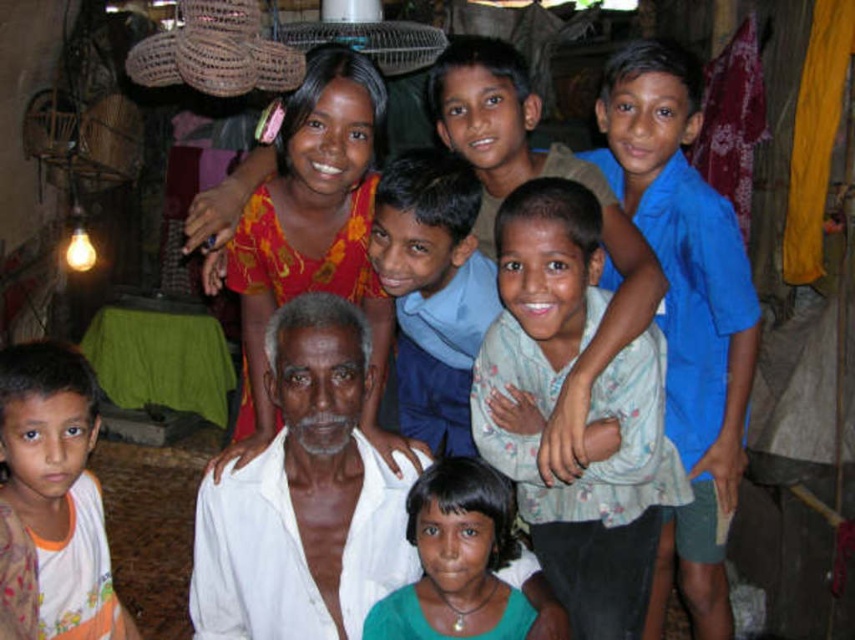
You are standing at the point marked by the coordinates point [638,262] in the image. What object is located exactly at that point?

The point [638,262] marks the white cotton shirt at center.

You are standing in the room and want to take a photo of the white cotton shirt at center. If your camera can focus on objects up to 6 feet away, will you be able to take a clear photo?

The white cotton shirt at center is 6.28 feet away from the camera, which is beyond the camera maximum focus distance of 6 feet. Therefore, the camera cannot focus on the white cotton shirt at center and the photo will be blurry.

You are standing in the scene and want to place a small gift on the white cloth at center. Where should you aim to place it?

The white cloth at center is located at the coordinates point [304,497], so you should aim for that position to place the small gift.